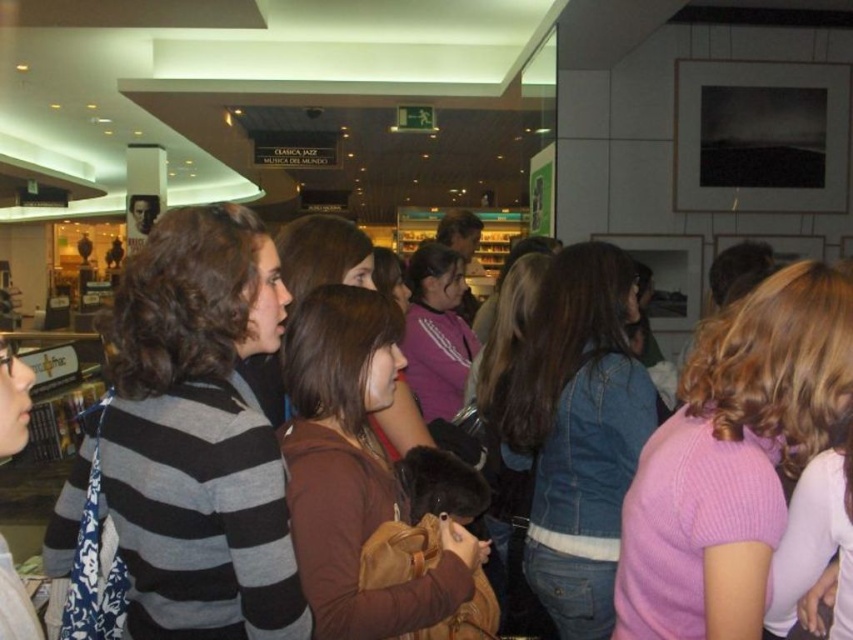
Does point (552, 428) lie behind point (399, 390)?

Yes, point (552, 428) is behind point (399, 390).

Where is `denim jacket at center`? Image resolution: width=853 pixels, height=640 pixels. denim jacket at center is located at coordinates (577, 429).

The width and height of the screenshot is (853, 640). Describe the element at coordinates (577, 429) in the screenshot. I see `denim jacket at center` at that location.

At what (x,y) coordinates should I click in order to perform the action: click on denim jacket at center. Please return your answer as a coordinate pair (x, y). Looking at the image, I should click on [x=577, y=429].

Between pink knitted sweater at center and brown leather purse at center, which one appears on the right side from the viewer's perspective?

pink knitted sweater at center

Does pink knitted sweater at center appear over brown leather purse at center?

Indeed, pink knitted sweater at center is positioned over brown leather purse at center.

Does point (691, 545) come farther from viewer compared to point (372, 269)?

No, it is in front of (372, 269).

Image resolution: width=853 pixels, height=640 pixels. I want to click on pink knitted sweater at center, so click(733, 458).

Does pink knitted sweater at center appear under purple cotton shirt at center?

Yes, pink knitted sweater at center is below purple cotton shirt at center.

Does pink knitted sweater at center appear on the left side of purple cotton shirt at center?

In fact, pink knitted sweater at center is to the right of purple cotton shirt at center.

The image size is (853, 640). Find the location of `pink knitted sweater at center`. pink knitted sweater at center is located at coordinates (733, 458).